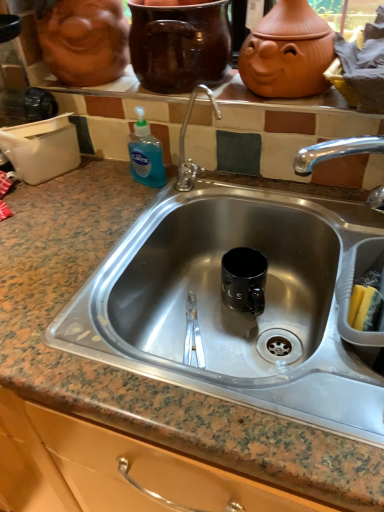
Question: Is glossy ceramic mug at upper center wider or thinner than marble granite sink at center?

Choices:
 (A) wide
 (B) thin

Answer: (B)

Question: Is point (130, 4) closer or farther from the camera than point (38, 193)?

Choices:
 (A) closer
 (B) farther

Answer: (A)

Question: Estimate the real-world distances between objects in this image. Which object is closer to the matte ceramic pots at upper center?

Choices:
 (A) matte ceramic face at upper left
 (B) marble granite sink at center
 (C) glossy ceramic mug at upper center

Answer: (C)

Question: Which object is positioned farthest from the matte ceramic face at upper left?

Choices:
 (A) matte ceramic pots at upper center
 (B) glossy ceramic mug at upper center
 (C) marble granite sink at center

Answer: (C)